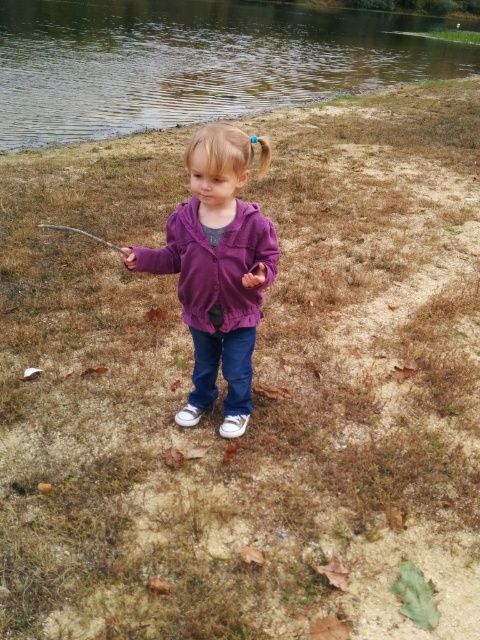
You are a photographer trying to capture a shot of the greenish reflective water at upper center and the brown wooden fishing pole at lower left. Which object should you focus on first if you want to ensure both are in clear focus?

The greenish reflective water at upper center is above the brown wooden fishing pole at lower left, so you should focus on the greenish reflective water at upper center first to ensure both are in clear focus.